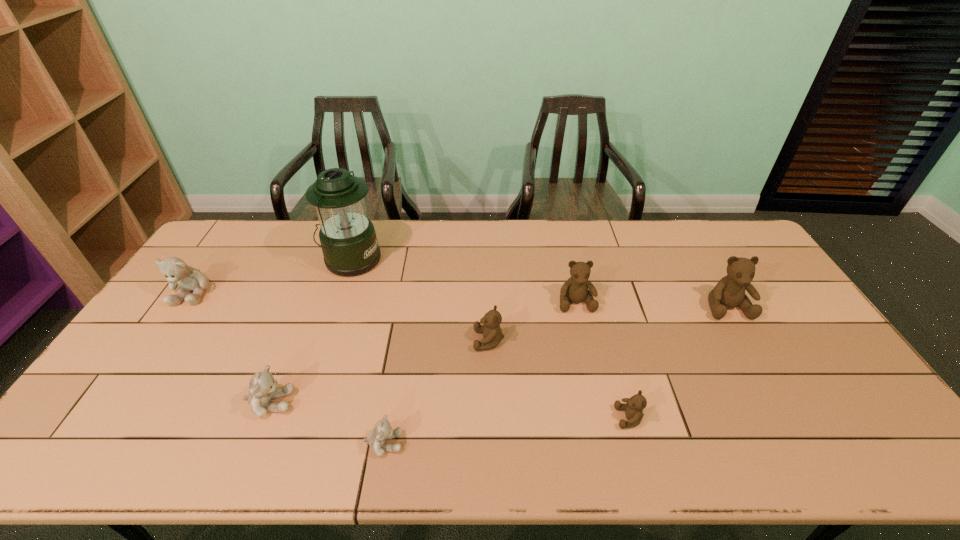
Identify the location of vacant space at the near edge of the desktop. The width and height of the screenshot is (960, 540). (550, 467).

This screenshot has height=540, width=960. In order to click on free space at the left edge of the desktop in this screenshot , I will do `click(150, 393)`.

Locate an element on the screen. free space at the far left corner of the desktop is located at coordinates (222, 238).

At what (x,y) coordinates should I click in order to perform the action: click on free point between the sixth teddy bear from right to left and the nearest gray teddy bear. Please return your answer as a coordinate pair (x, y). Image resolution: width=960 pixels, height=540 pixels. Looking at the image, I should click on (326, 423).

Where is `free spot between the biggest gray teddy bear and the third smallest brown teddy bear`? The image size is (960, 540). free spot between the biggest gray teddy bear and the third smallest brown teddy bear is located at coordinates (384, 297).

Locate an element on the screen. The width and height of the screenshot is (960, 540). vacant region between the second farthest gray teddy bear and the second tallest object is located at coordinates (498, 355).

Locate an element on the screen. The height and width of the screenshot is (540, 960). vacant area that lies between the leftmost object and the fifth object from right to left is located at coordinates (288, 368).

Where is `free space that is in between the lantern and the third smallest brown teddy bear`? The width and height of the screenshot is (960, 540). free space that is in between the lantern and the third smallest brown teddy bear is located at coordinates (464, 281).

I want to click on free area in between the third smallest brown teddy bear and the nearest brown teddy bear, so click(x=602, y=360).

The width and height of the screenshot is (960, 540). What are the coordinates of `free space between the third smallest brown teddy bear and the second tallest object` in the screenshot? It's located at point(651,304).